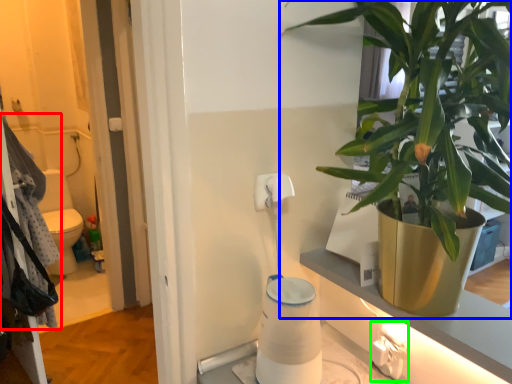
Question: Which object is the closest to the laundry (highlighted by a red box)? Choose among these: houseplant (highlighted by a blue box) or electric outlet (highlighted by a green box).

Choices:
 (A) houseplant
 (B) electric outlet

Answer: (A)